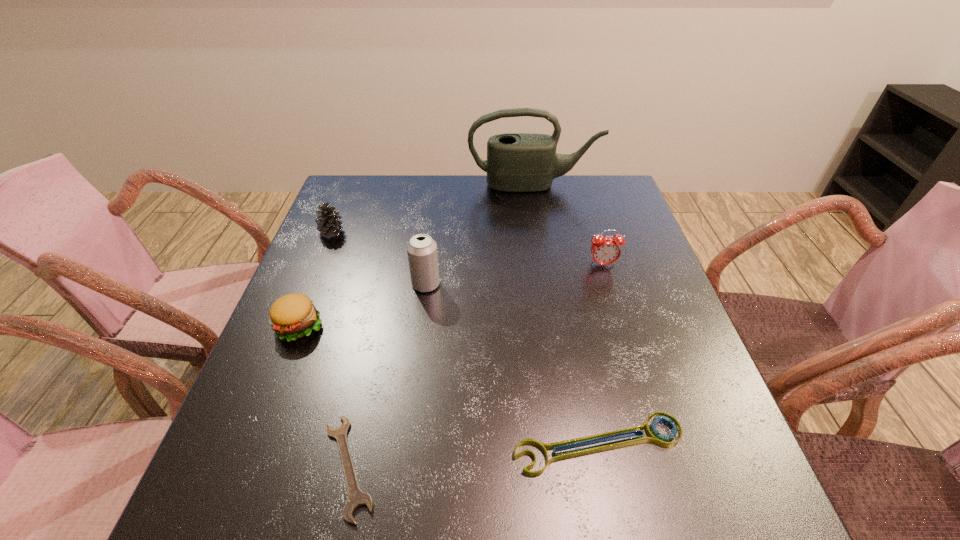
I want to click on object situated at the far edge, so click(x=516, y=162).

You are a GUI agent. You are given a task and a screenshot of the screen. Output one action in this format:
    pyautogui.click(x=<x>, y=<y>)
    Task: Click on the pinecone positioned at the left edge
    This screenshot has width=960, height=540.
    Given the screenshot: What is the action you would take?
    pyautogui.click(x=328, y=225)

The width and height of the screenshot is (960, 540). I want to click on hamburger that is at the left edge, so [x=292, y=316].

Find the location of a particular element. This screenshot has height=540, width=960. watering can at the right edge is located at coordinates (516, 162).

Find the location of a particular element. Image resolution: width=960 pixels, height=540 pixels. alarm clock that is positioned at the right edge is located at coordinates (605, 250).

You are a GUI agent. You are given a task and a screenshot of the screen. Output one action in this format:
    pyautogui.click(x=<x>, y=<y>)
    Task: Click on the wrench that is at the right edge
    The image size is (960, 540).
    Given the screenshot: What is the action you would take?
    pyautogui.click(x=654, y=436)

The height and width of the screenshot is (540, 960). What are the coordinates of `object that is at the far right corner` in the screenshot? It's located at (516, 162).

Find the location of a particular element. Image resolution: width=960 pixels, height=540 pixels. object at the near right corner is located at coordinates (654, 436).

Identify the location of vacant space at the near edge. The image size is (960, 540). (325, 536).

At what (x,y) coordinates should I click in order to perform the action: click on vacant space at the left edge of the desktop. Please return your answer as a coordinate pair (x, y). Looking at the image, I should click on (278, 451).